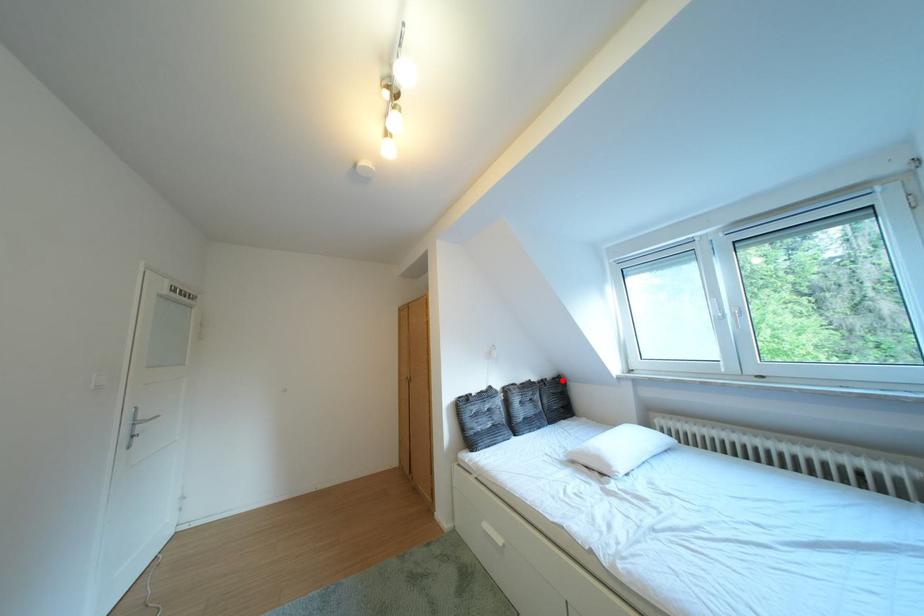
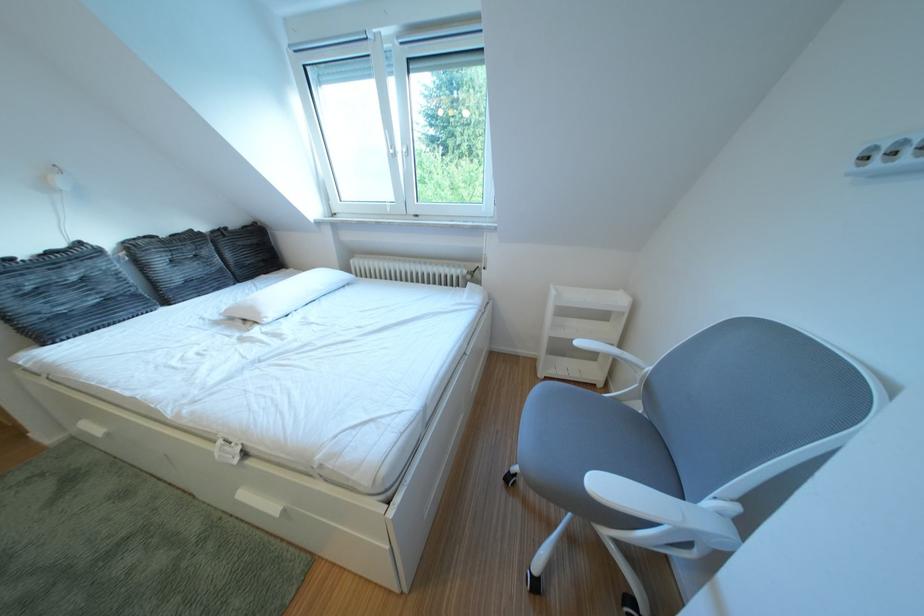
Locate, in the second image, the point that corresponds to the highlighted location in the first image.

(247, 228)